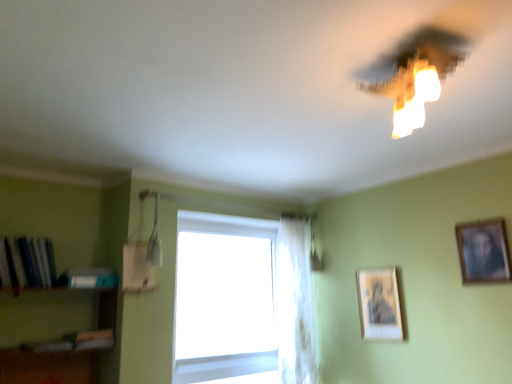
Question: Is transparent glass window at center in front of or behind matte white light fixture at upper right in the image?

Choices:
 (A) front
 (B) behind

Answer: (B)

Question: Do you think transparent glass window at center is within matte white light fixture at upper right, or outside of it?

Choices:
 (A) inside
 (B) outside

Answer: (B)

Question: Based on their relative distances, which object is farther from the wooden framed portrait at upper right, marked as the 1th picture frame in a front-to-back arrangement?

Choices:
 (A) wooden shelf at lower left
 (B) transparent glass window at center
 (C) white sheer curtain at center
 (D) hardcover book at left, arranged as the 2th book when viewed from the left
 (E) matte gold picture frame at center-right, which is counted as the 2th picture frame, starting from the right

Answer: (A)

Question: Considering the real-world distances, which object is farthest from the matte white light fixture at upper right?

Choices:
 (A) hardcover book at left, arranged as the 2th book when viewed from the left
 (B) white sheer curtain at center
 (C) shiny blue book at left, marked as the second book in a right-to-left arrangement
 (D) matte gold picture frame at center-right, the 1th picture frame from the back
 (E) transparent glass window at center

Answer: (C)